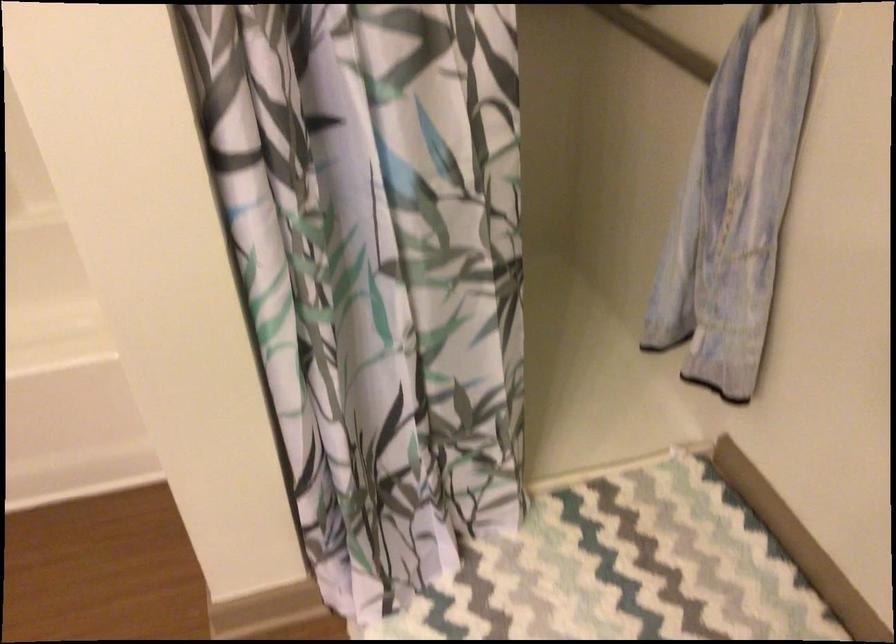
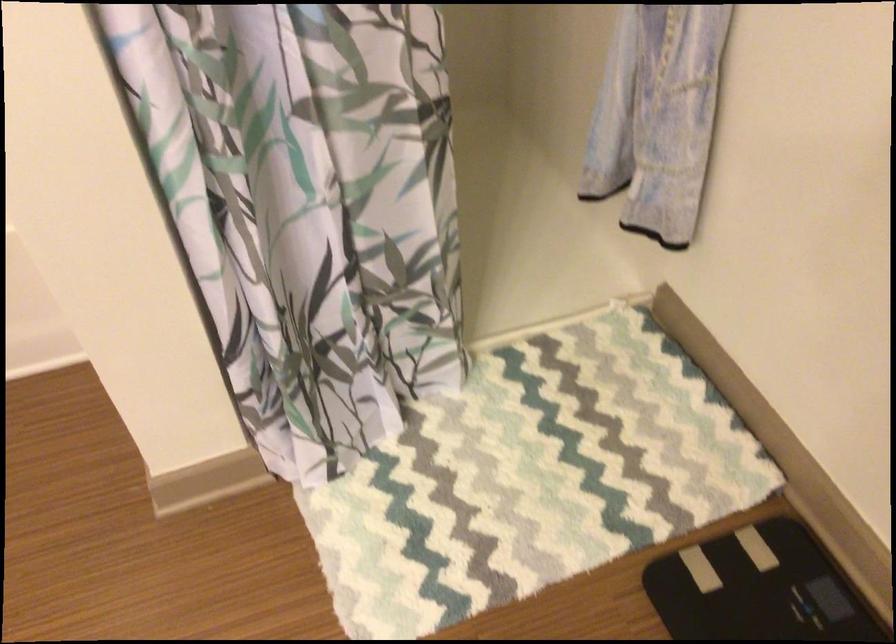
Question: The first image is from the beginning of the video and the second image is from the end. How did the camera likely rotate when shooting the video?

Choices:
 (A) Left
 (B) Right
 (C) Up
 (D) Down

Answer: (D)